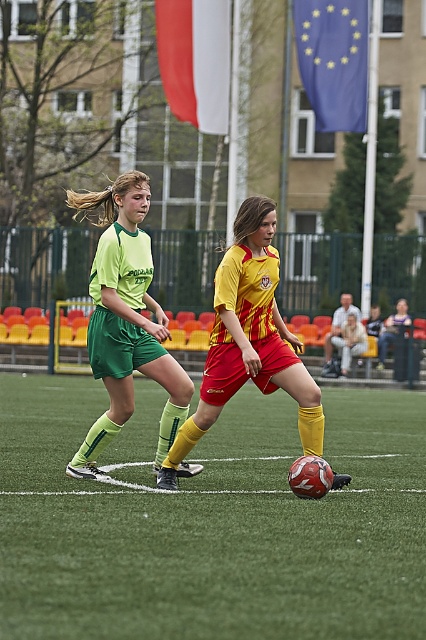
You are a referee standing at the matte green shorts at center during a soccer match. You need to retrieve the white fabric flag at upper center to signal an offside. Can you reach it without leaving your current position?

The distance between matte green shorts at center and white fabric flag at upper center is 17.08 meters, so you cannot reach it without moving from your current position.